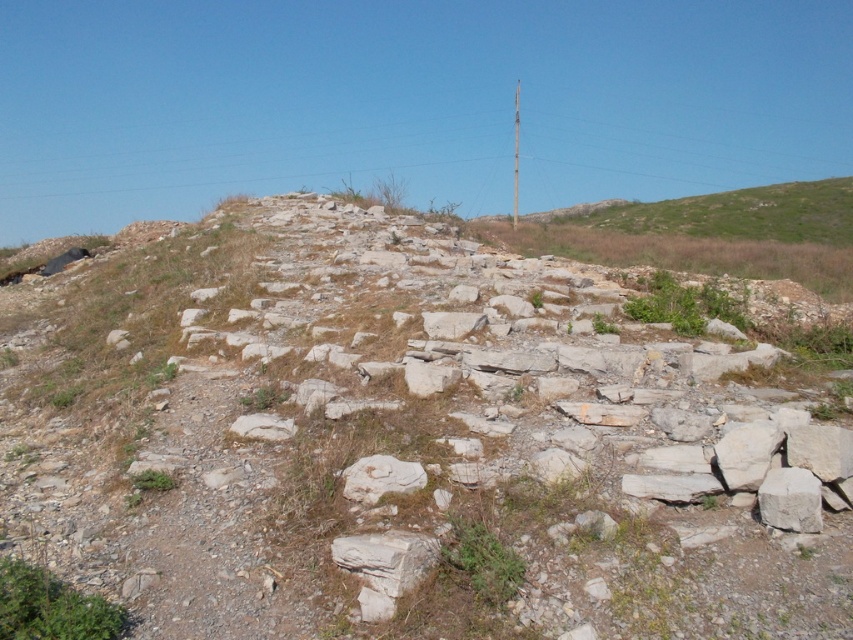
You are a geologist examining the rugged outdoor scene. You notice the gray stone rubble at center. Based on its position, can you determine if it is closer to the foreground or the middle ground?

The gray stone rubble at center is located at point (407, 440), which places it in the middle ground of the scene since the middle ground starts at approximately 0.5 coordinate in this context.

You are an environmental scientist assessing the vegetation in this rocky terrain. You notice two patches of greenery, the green leafy grass at lower left and the green grassy at center. Which of these patches has a greater coverage area?

The green leafy grass at lower left has a larger size compared to the green grassy at center, so it has a greater coverage area.